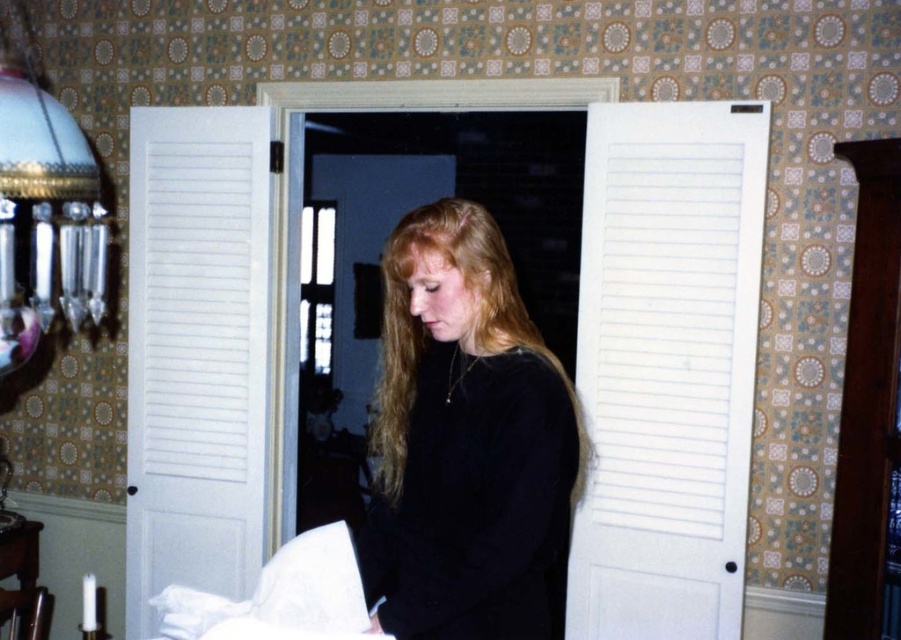
Question: Is black velvet sweater at center bigger than matte glass lampshade at left?

Choices:
 (A) yes
 (B) no

Answer: (B)

Question: Which point is closer to the camera taking this photo?

Choices:
 (A) (99, 252)
 (B) (496, 563)

Answer: (B)

Question: Does black velvet sweater at center appear on the right side of matte glass lampshade at left?

Choices:
 (A) no
 (B) yes

Answer: (B)

Question: Is black velvet sweater at center below matte glass lampshade at left?

Choices:
 (A) no
 (B) yes

Answer: (B)

Question: Which of the following is the closest to the observer?

Choices:
 (A) (8, 118)
 (B) (428, 568)

Answer: (B)